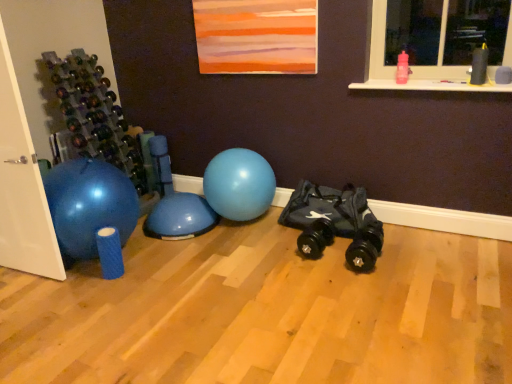
Where is `blue rubber ball at center`? Image resolution: width=512 pixels, height=384 pixels. blue rubber ball at center is located at coordinates (239, 184).

At what (x,y) coordinates should I click in order to perform the action: click on pink plastic water bottle at upper right. Please return your answer as a coordinate pair (x, y). The image size is (512, 384). Looking at the image, I should click on (417, 66).

You are a GUI agent. You are given a task and a screenshot of the screen. Output one action in this format:
    pyautogui.click(x=<x>, y=<y>)
    Task: Click on the black rubber toy car at center
    
    Given the screenshot: What is the action you would take?
    tap(334, 222)

Is black rubber toy car at center situated inside pink plastic water bottle at upper right or outside?

black rubber toy car at center is spatially situated outside pink plastic water bottle at upper right.

Where is `toy car located underneath the pink plastic water bottle at upper right (from a real-world perspective)`? This screenshot has width=512, height=384. toy car located underneath the pink plastic water bottle at upper right (from a real-world perspective) is located at coordinates (334, 222).

From the image's perspective, is black rubber toy car at center above or below pink plastic water bottle at upper right?

Clearly, from the image's perspective, black rubber toy car at center is below pink plastic water bottle at upper right.

Which is nearer, (378, 248) or (449, 88)?

The point (449, 88) is more forward.

Considering the sizes of objects black rubber toy car at center and blue rubber ball at center in the image provided, who is taller, black rubber toy car at center or blue rubber ball at center?

Standing taller between the two is blue rubber ball at center.

Is black rubber toy car at center to the left of blue rubber ball at center from the viewer's perspective?

Incorrect, black rubber toy car at center is not on the left side of blue rubber ball at center.

Looking at this image, is black rubber toy car at center wider than blue rubber ball at center?

No.

Considering the relative sizes of blue rubber ball at center and black rubber toy car at center in the image provided, is blue rubber ball at center smaller than black rubber toy car at center?

Actually, blue rubber ball at center might be larger than black rubber toy car at center.

Between blue rubber ball at center and black rubber toy car at center, which one has smaller width?

Thinner between the two is black rubber toy car at center.

Based on the photo, from a real-world perspective, is pink plastic water bottle at upper right positioned over black rubber toy car at center based on gravity?

Yes, from a real-world perspective, pink plastic water bottle at upper right is above black rubber toy car at center.

Is the surface of pink plastic water bottle at upper right in direct contact with black rubber toy car at center?

No, pink plastic water bottle at upper right is not touching black rubber toy car at center.

Is point (372, 30) closer to viewer compared to point (290, 207)?

Yes, it is in front of point (290, 207).

In terms of size, does pink plastic water bottle at upper right appear bigger or smaller than black rubber toy car at center?

pink plastic water bottle at upper right is smaller than black rubber toy car at center.

Is blue rubber ball at center smaller than pink plastic water bottle at upper right?

No, blue rubber ball at center is not smaller than pink plastic water bottle at upper right.

Does point (230, 201) come farther from viewer compared to point (385, 30)?

Yes.

Which object is wider, blue rubber ball at center or pink plastic water bottle at upper right?

blue rubber ball at center is wider.

In the scene shown: From the image's perspective, is blue rubber ball at center over pink plastic water bottle at upper right?

No, from the image's perspective, blue rubber ball at center is not over pink plastic water bottle at upper right.

Is pink plastic water bottle at upper right completely or partially outside of blue rubber ball at center?

Absolutely, pink plastic water bottle at upper right is external to blue rubber ball at center.

Is pink plastic water bottle at upper right turned away from blue rubber ball at center?

No, pink plastic water bottle at upper right's orientation is not away from blue rubber ball at center.

Are pink plastic water bottle at upper right and blue rubber ball at center located far from each other?

Yes, pink plastic water bottle at upper right is far from blue rubber ball at center.

Does point (382, 51) appear closer or farther from the camera than point (243, 218)?

Point (382, 51) is closer to the camera than point (243, 218).

Where is `toy car below the pink plastic water bottle at upper right (from the image's perspective)`? toy car below the pink plastic water bottle at upper right (from the image's perspective) is located at coordinates (334, 222).

Locate an element on the screen. toy car below the blue rubber ball at center (from a real-world perspective) is located at coordinates (334, 222).

Estimate the real-world distances between objects in this image. Which object is further from blue rubber ball at center, black rubber toy car at center or pink plastic water bottle at upper right?

→ pink plastic water bottle at upper right lies further to blue rubber ball at center than the other object.

From the image, which object appears to be nearer to pink plastic water bottle at upper right, blue rubber ball at center or black rubber toy car at center?

black rubber toy car at center.

Looking at the image, which one is located further to black rubber toy car at center, blue rubber ball at center or pink plastic water bottle at upper right?

pink plastic water bottle at upper right is further to black rubber toy car at center.

Looking at the image, which one is located closer to blue rubber ball at center, pink plastic water bottle at upper right or black rubber toy car at center?

black rubber toy car at center is positioned closer to the anchor blue rubber ball at center.

Looking at the image, which one is located closer to black rubber toy car at center, pink plastic water bottle at upper right or blue rubber ball at center?

blue rubber ball at center is positioned closer to the anchor black rubber toy car at center.

From the image, which object appears to be farther from pink plastic water bottle at upper right, black rubber toy car at center or blue rubber ball at center?

Among the two, blue rubber ball at center is located further to pink plastic water bottle at upper right.

Locate an element on the screen. toy car situated between blue rubber ball at center and pink plastic water bottle at upper right from left to right is located at coordinates click(x=334, y=222).